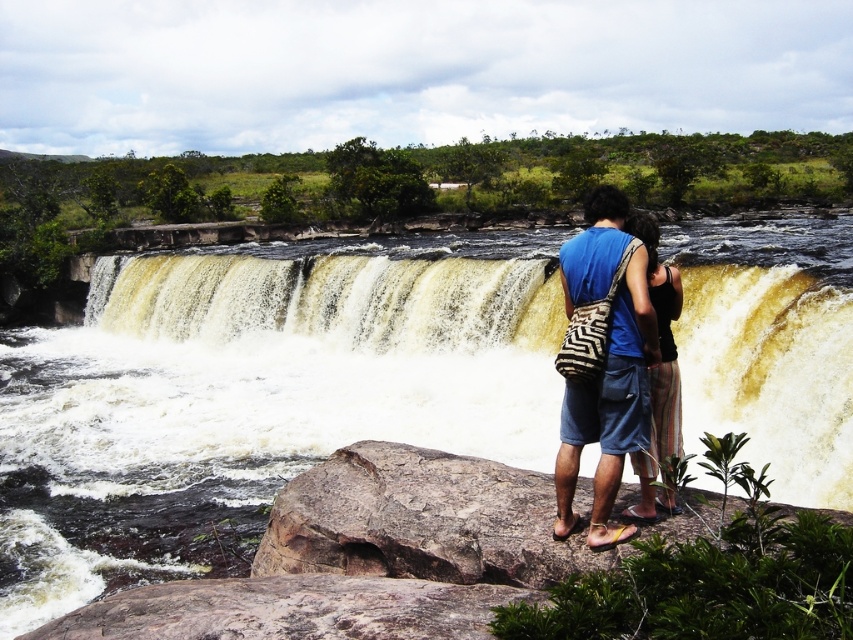
You are a photographer planning to take a wide shot of the brown textured water at center and the blue cotton shirt at center. Which object will occupy more horizontal space in the photo?

The brown textured water at center has a greater width than the blue cotton shirt at center, so it will occupy more horizontal space in the photo.

You are planning to take a photo of the brown textured water at center and the blue cotton shirt at center. Which object should you focus on first if you want to capture both in a single frame without moving the camera?

You should focus on the blue cotton shirt at center first because the brown textured water at center is to the left of it, so adjusting focus from the shirt to the water to the left would keep both in frame.

You are planning to cross the river at the waterfall. You see the brown textured water at center and the brown rough rock at center. Which one should you avoid stepping on to safely cross the river?

You should avoid stepping on the brown rough rock at center because it is behind the brown textured water at center, meaning the water is in front and might be deeper or more stable for crossing.